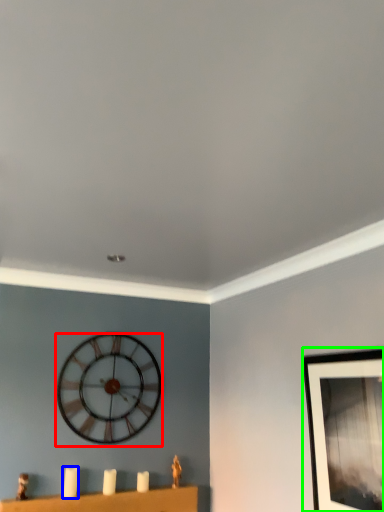
Question: Which object is the farthest from wall clock (highlighted by a red box)? Choose among these: candle (highlighted by a blue box) or picture frame (highlighted by a green box).

Choices:
 (A) candle
 (B) picture frame

Answer: (B)